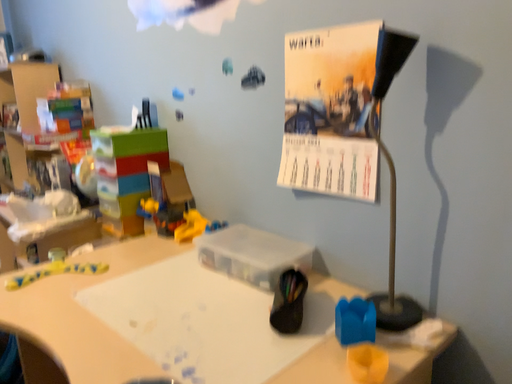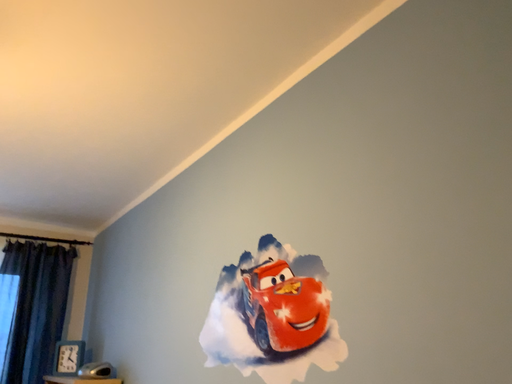
Question: Which way did the camera rotate in the video?

Choices:
 (A) rotated right
 (B) rotated left

Answer: (B)